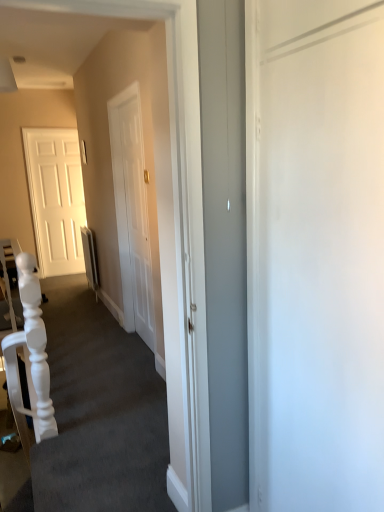
Question: Considering the relative sizes of white matte stairwell at center and white glossy door at left in the image provided, is white matte stairwell at center wider than white glossy door at left?

Choices:
 (A) no
 (B) yes

Answer: (B)

Question: Is white glossy door at left surrounded by white matte stairwell at center?

Choices:
 (A) yes
 (B) no

Answer: (B)

Question: Considering the relative positions of white matte stairwell at center and white glossy door at left in the image provided, is white matte stairwell at center to the right of white glossy door at left from the viewer's perspective?

Choices:
 (A) yes
 (B) no

Answer: (A)

Question: Is white matte stairwell at center shorter than white glossy door at left?

Choices:
 (A) no
 (B) yes

Answer: (B)

Question: Is white matte stairwell at center oriented away from white glossy door at left?

Choices:
 (A) no
 (B) yes

Answer: (A)

Question: Is white matte stairwell at center outside white glossy door at left?

Choices:
 (A) yes
 (B) no

Answer: (A)

Question: Does white glossy door at left contain white matte stairwell at center?

Choices:
 (A) no
 (B) yes

Answer: (A)

Question: Considering the relative sizes of white glossy door at left and white matte stairwell at center in the image provided, is white glossy door at left bigger than white matte stairwell at center?

Choices:
 (A) no
 (B) yes

Answer: (A)

Question: Does white glossy door at left have a smaller size compared to white matte stairwell at center?

Choices:
 (A) no
 (B) yes

Answer: (B)

Question: Would you say white glossy door at left is a long distance from white matte stairwell at center?

Choices:
 (A) yes
 (B) no

Answer: (A)

Question: Is white glossy door at left oriented towards white matte stairwell at center?

Choices:
 (A) yes
 (B) no

Answer: (A)

Question: From a real-world perspective, is white glossy door at left physically below white matte stairwell at center?

Choices:
 (A) yes
 (B) no

Answer: (B)

Question: Could you tell me if white glossy door at left is facing white matte armchair at left?

Choices:
 (A) no
 (B) yes

Answer: (A)